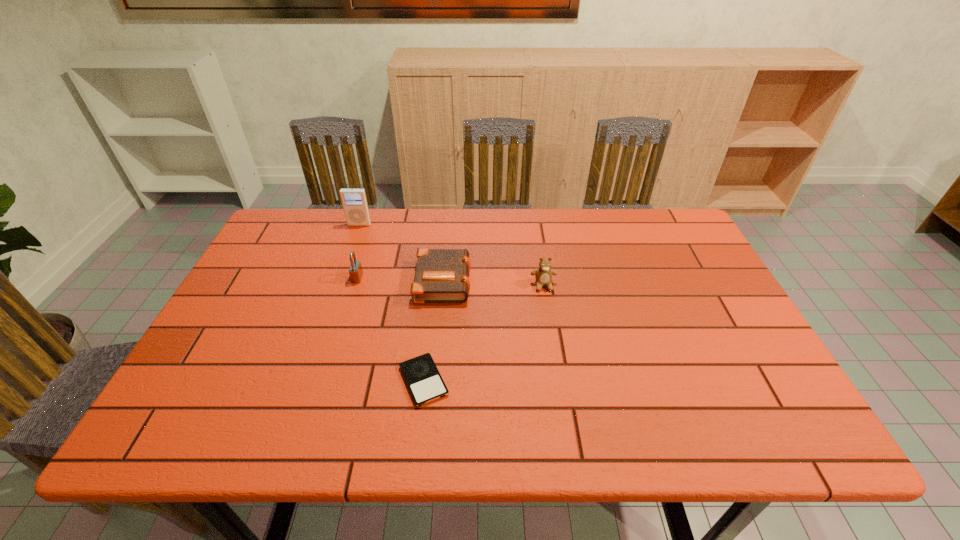
Where is `vacant space that satisfies the following two spatial constraints: 1. on the front-facing side of the farthest object; 2. on the right side of the nearer iPod`? vacant space that satisfies the following two spatial constraints: 1. on the front-facing side of the farthest object; 2. on the right side of the nearer iPod is located at coordinates (305, 381).

You are a GUI agent. You are given a task and a screenshot of the screen. Output one action in this format:
    pyautogui.click(x=<x>, y=<y>)
    Task: Click on the vacant space that satisfies the following two spatial constraints: 1. on the front-facing side of the farther iPod; 2. on the left side of the shortest object
    
    Given the screenshot: What is the action you would take?
    pyautogui.click(x=305, y=381)

Where is `vacant area in the image that satisfies the following two spatial constraints: 1. on the front-facing side of the taller iPod; 2. on the right side of the shorter iPod`? vacant area in the image that satisfies the following two spatial constraints: 1. on the front-facing side of the taller iPod; 2. on the right side of the shorter iPod is located at coordinates (305, 381).